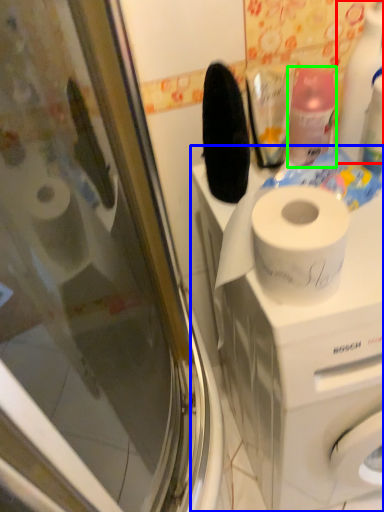
Question: Which object is the closest to the cleaning product (highlighted by a red box)? Choose among these: washing machine (highlighted by a blue box) or cleaning product (highlighted by a green box).

Choices:
 (A) washing machine
 (B) cleaning product

Answer: (B)